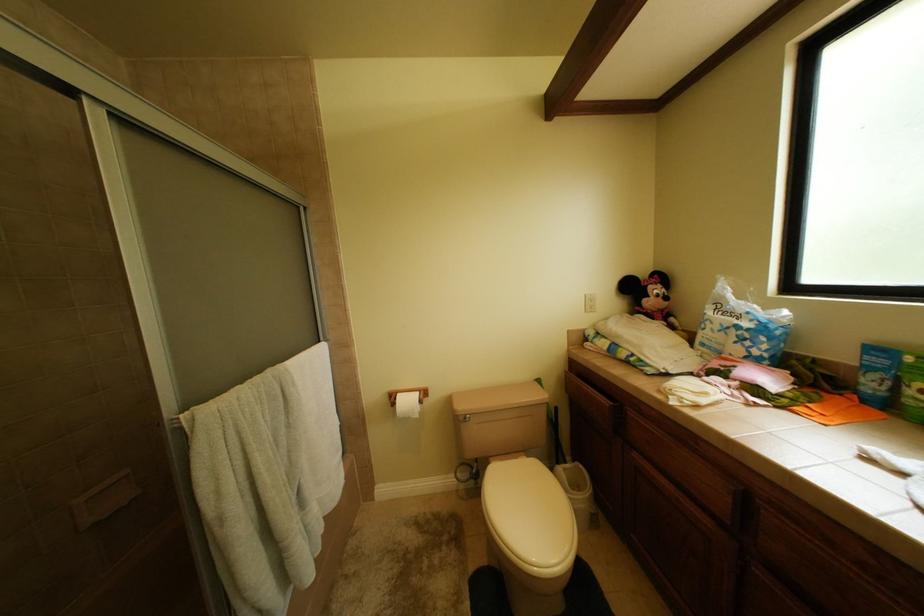
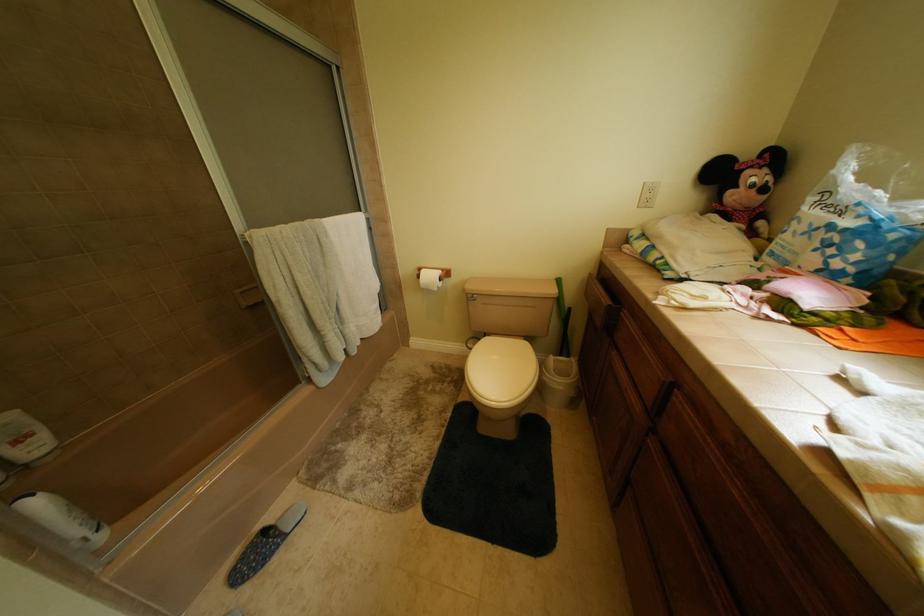
Question: In a continuous first-person perspective shot, in which direction is the camera moving?

Choices:
 (A) Left
 (B) Right
 (C) Forward
 (D) Backward

Answer: (B)